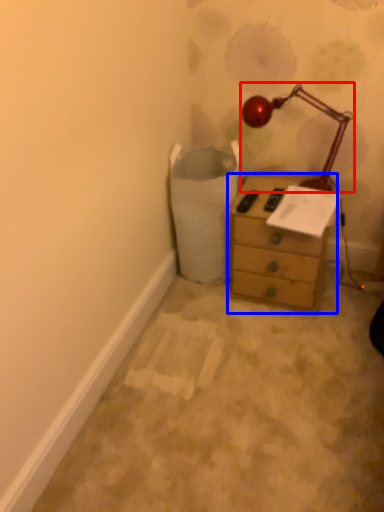
Question: Which of the following is the farthest to the observer, lamp (highlighted by a red box) or chest of drawers (highlighted by a blue box)?

Choices:
 (A) lamp
 (B) chest of drawers

Answer: (B)